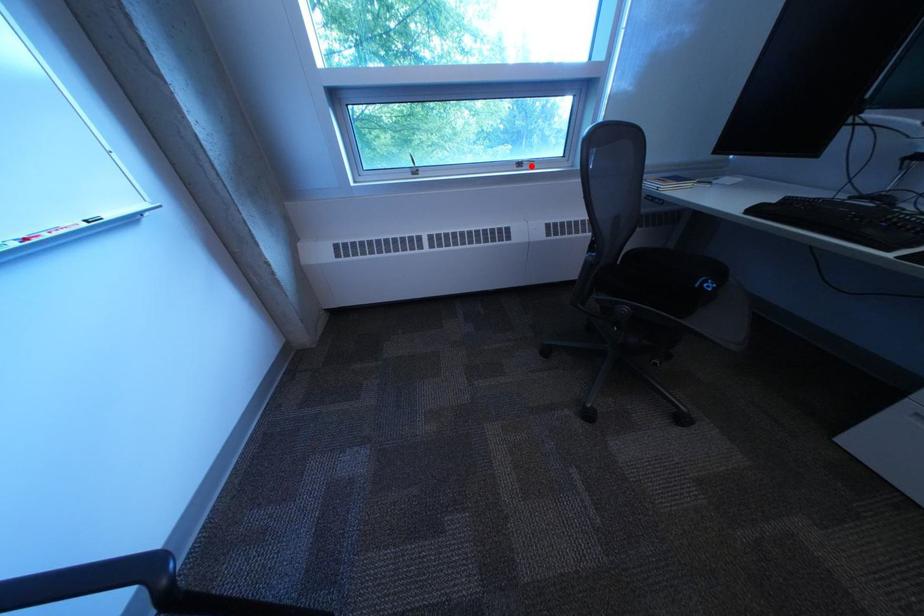
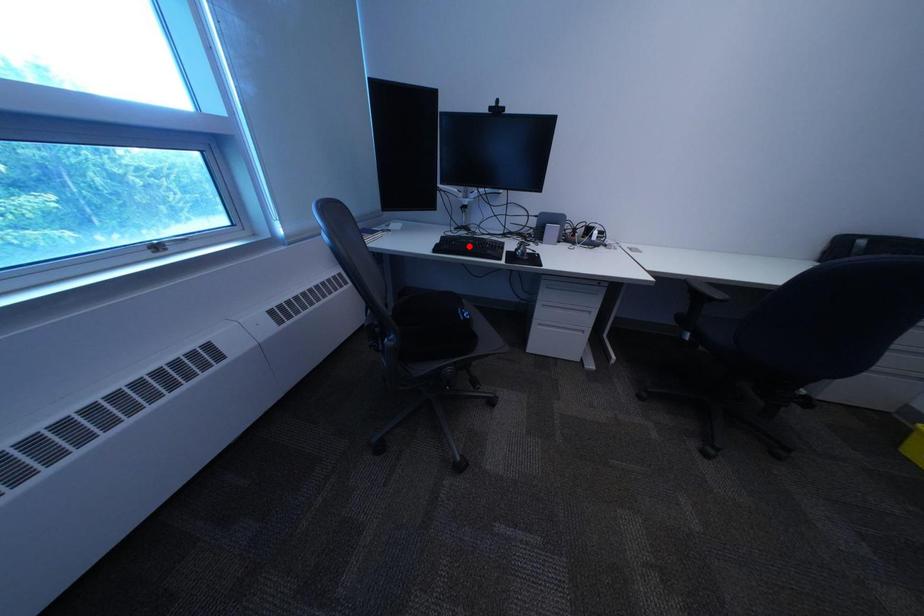
I am providing you with two images of the same scene from different viewpoints. A red point is marked on the first image and another point is marked on the second image. Do the highlighted points in image1 and image2 indicate the same real-world spot?

No